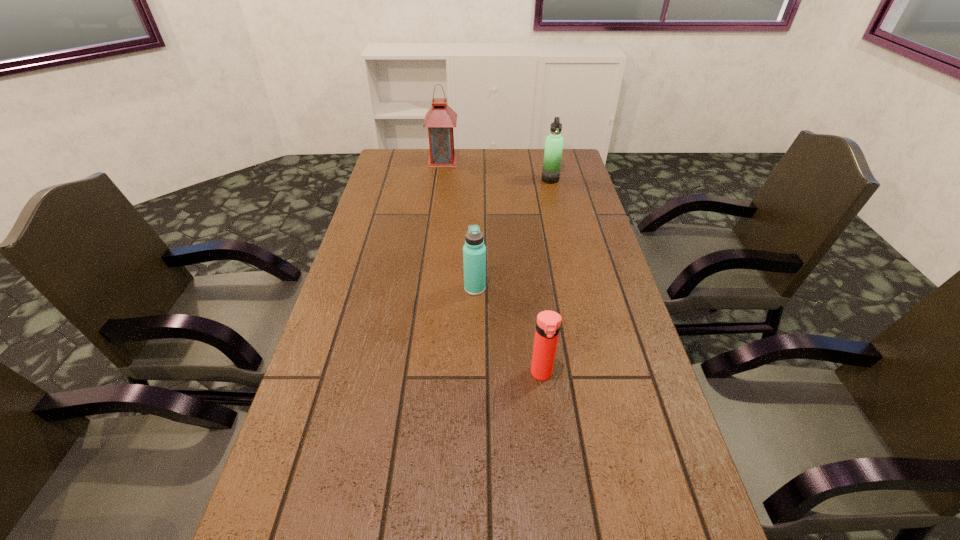
Identify the location of thermos bottle that is the second closest to the tallest thermos bottle. (548, 323).

Locate an element on the screen. This screenshot has height=540, width=960. thermos bottle that is the second closest to the second nearest object is located at coordinates (554, 142).

Where is `free spot that satisfies the following two spatial constraints: 1. on the front side of the leftmost thermos bottle; 2. on the right side of the second thermos bottle from right to left`? The width and height of the screenshot is (960, 540). free spot that satisfies the following two spatial constraints: 1. on the front side of the leftmost thermos bottle; 2. on the right side of the second thermos bottle from right to left is located at coordinates (474, 374).

Locate an element on the screen. The height and width of the screenshot is (540, 960). free spot that satisfies the following two spatial constraints: 1. on the front side of the rightmost thermos bottle; 2. on the right side of the leftmost object is located at coordinates (441, 179).

The height and width of the screenshot is (540, 960). Find the location of `vacant area in the image that satisfies the following two spatial constraints: 1. on the front side of the third object from left to right; 2. on the left side of the second nearest object`. vacant area in the image that satisfies the following two spatial constraints: 1. on the front side of the third object from left to right; 2. on the left side of the second nearest object is located at coordinates (474, 374).